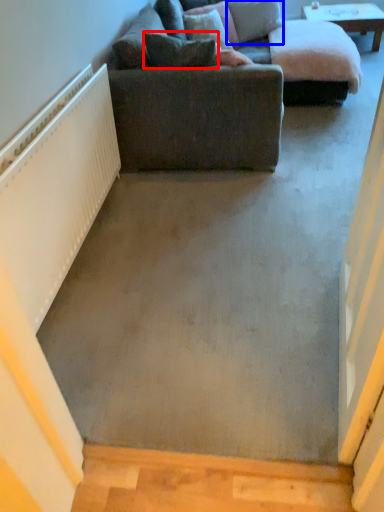
Question: Among these objects, which one is nearest to the camera, pillow (highlighted by a red box) or pillow (highlighted by a blue box)?

Choices:
 (A) pillow
 (B) pillow

Answer: (A)